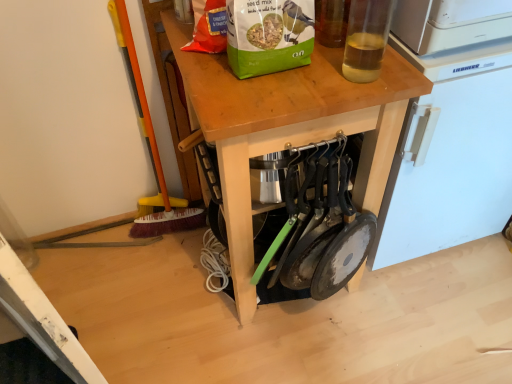
Question: Could you tell me if white plastic refrigerator at upper right is turned towards wooden at center?

Choices:
 (A) yes
 (B) no

Answer: (B)

Question: Is white plastic refrigerator at upper right in front of wooden at center?

Choices:
 (A) no
 (B) yes

Answer: (A)

Question: Is wooden at center completely or partially inside white plastic refrigerator at upper right?

Choices:
 (A) yes
 (B) no

Answer: (B)

Question: From a real-world perspective, is white plastic refrigerator at upper right physically above wooden at center?

Choices:
 (A) no
 (B) yes

Answer: (B)

Question: Can you confirm if white plastic refrigerator at upper right is positioned to the left of wooden at center?

Choices:
 (A) no
 (B) yes

Answer: (A)

Question: Considering the positions of green matte paper bag at upper center and wooden at center in the image, is green matte paper bag at upper center taller or shorter than wooden at center?

Choices:
 (A) tall
 (B) short

Answer: (B)

Question: From a real-world perspective, is green matte paper bag at upper center above or below wooden at center?

Choices:
 (A) below
 (B) above

Answer: (B)

Question: From the image's perspective, is green matte paper bag at upper center located above or below wooden at center?

Choices:
 (A) above
 (B) below

Answer: (A)

Question: Considering the positions of point (305, 8) and point (283, 122), is point (305, 8) closer or farther from the camera than point (283, 122)?

Choices:
 (A) farther
 (B) closer

Answer: (A)

Question: Considering the relative positions of green matte paper bag at upper center and white plastic refrigerator at upper right in the image provided, is green matte paper bag at upper center to the left or to the right of white plastic refrigerator at upper right?

Choices:
 (A) right
 (B) left

Answer: (B)

Question: Is green matte paper bag at upper center wider or thinner than white plastic refrigerator at upper right?

Choices:
 (A) wide
 (B) thin

Answer: (B)

Question: Does point tap(310, 31) appear closer or farther from the camera than point tap(431, 172)?

Choices:
 (A) farther
 (B) closer

Answer: (B)

Question: From the image's perspective, is green matte paper bag at upper center above or below white plastic refrigerator at upper right?

Choices:
 (A) below
 (B) above

Answer: (B)

Question: In terms of height, does white plastic refrigerator at upper right look taller or shorter compared to translucent glass bottle at upper right?

Choices:
 (A) short
 (B) tall

Answer: (B)

Question: Is white plastic refrigerator at upper right situated inside translucent glass bottle at upper right or outside?

Choices:
 (A) inside
 (B) outside

Answer: (B)